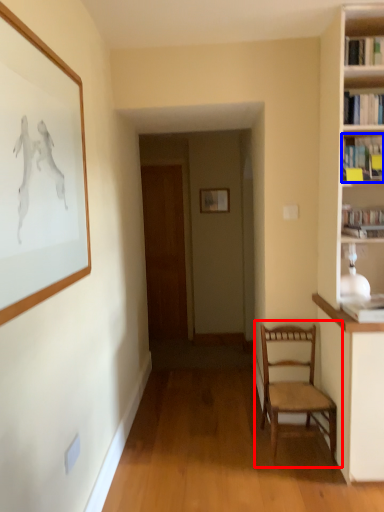
Question: Which object is closer to the camera taking this photo, chair (highlighted by a red box) or book (highlighted by a blue box)?

Choices:
 (A) chair
 (B) book

Answer: (A)